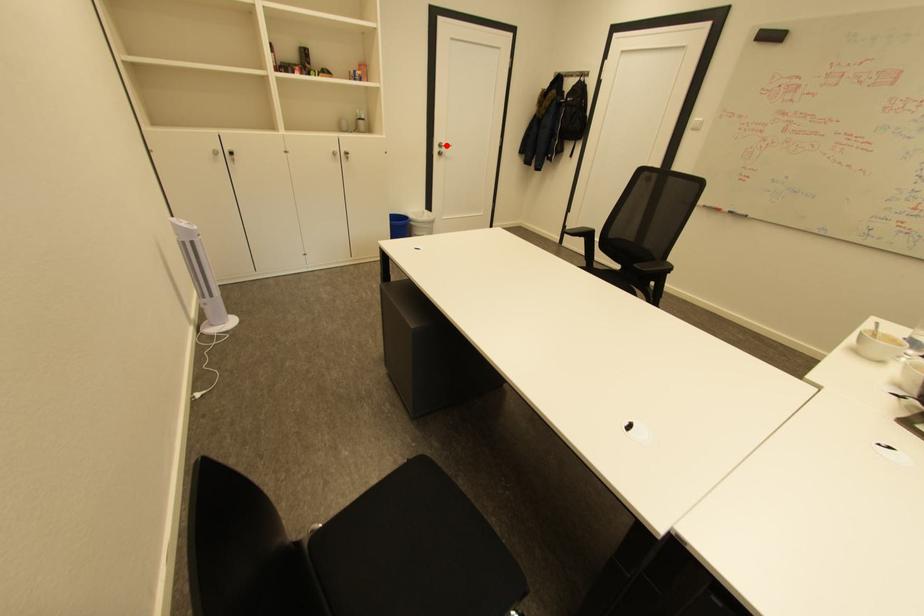
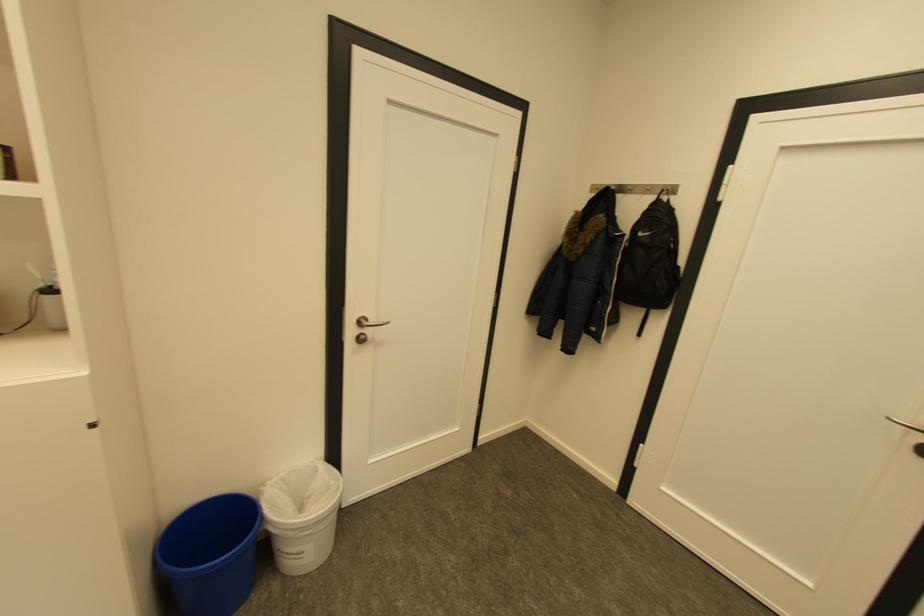
Question: A red point is marked in image1. In image2, is the corresponding 3D point closer to the camera or farther? Reply with the corresponding letter.

Choices:
 (A) The corresponding 3D point is closer.
 (B) The corresponding 3D point is farther.

Answer: (B)